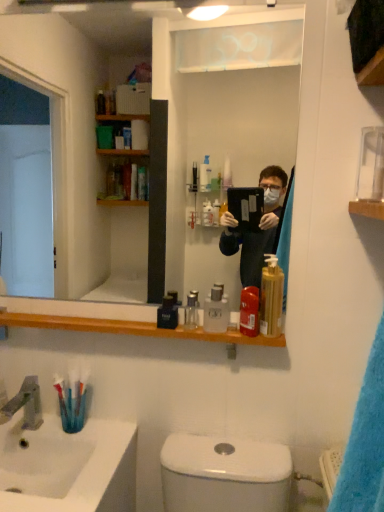
Question: Considering the positions of translucent plastic toothbrush at lower left and satin nickel faucet at sink left in the image, is translucent plastic toothbrush at lower left bigger or smaller than satin nickel faucet at sink left?

Choices:
 (A) small
 (B) big

Answer: (A)

Question: Is translucent plastic toothbrush at lower left inside or outside of satin nickel faucet at sink left?

Choices:
 (A) inside
 (B) outside

Answer: (B)

Question: Estimate the real-world distances between objects in this image. Which object is farther from the white glossy sink at lower left?

Choices:
 (A) translucent plastic toothbrush at lower left
 (B) clear glass bottle at center, arranged as the second mouthwash when viewed from the left
 (C) clear glass mirror at upper center
 (D) clear plastic bottle at center, which ranks as the 2th mouthwash in right-to-left order
 (E) translucent plastic mouthwash at shelf center, the fourth mouthwash positioned from the left

Answer: (C)

Question: Estimate the real-world distances between objects in this image. Which object is closer to the translucent plastic toothbrush at lower left?

Choices:
 (A) clear glass bottle at center, the third mouthwash in the right-to-left sequence
 (B) clear plastic bottle at center, which ranks as the 2th mouthwash in right-to-left order
 (C) black glossy bottle at center, which ranks as the fourth mouthwash in right-to-left order
 (D) satin nickel faucet at sink left
 (E) white glossy sink at lower left

Answer: (D)